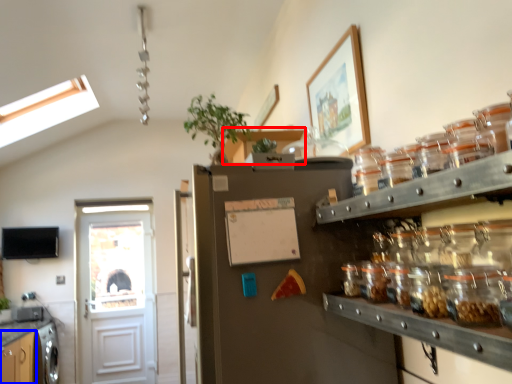
Question: Which point is further to the camera, cabinetry (highlighted by a red box) or cabinetry (highlighted by a blue box)?

Choices:
 (A) cabinetry
 (B) cabinetry

Answer: (B)